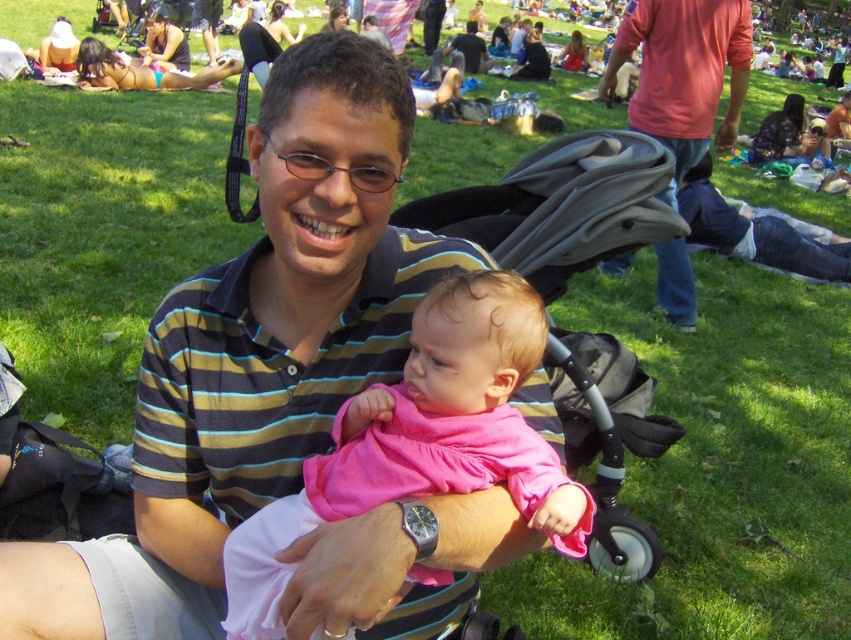
Who is shorter, pink fabric baby at center or matte pink shirt at upper right?

pink fabric baby at center

Locate an element on the screen. pink fabric baby at center is located at coordinates (421, 442).

Between point (437, 298) and point (707, 10), which one is positioned behind?

Point (707, 10)

Locate an element on the screen. pink fabric baby at center is located at coordinates (421, 442).